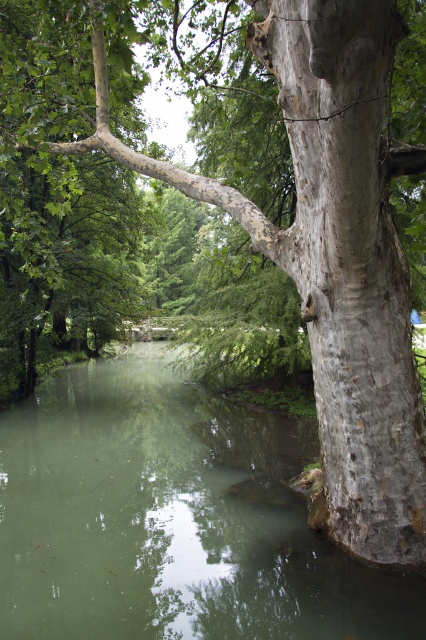
Question: Is green smooth water at center positioned behind smooth gray bark at right?

Choices:
 (A) no
 (B) yes

Answer: (B)

Question: Which of the following is the closest to the observer?

Choices:
 (A) (23, 609)
 (B) (362, 554)

Answer: (A)

Question: Does green smooth water at center appear on the left side of smooth gray bark at right?

Choices:
 (A) no
 (B) yes

Answer: (B)

Question: Does green smooth water at center have a larger size compared to smooth gray bark at right?

Choices:
 (A) no
 (B) yes

Answer: (B)